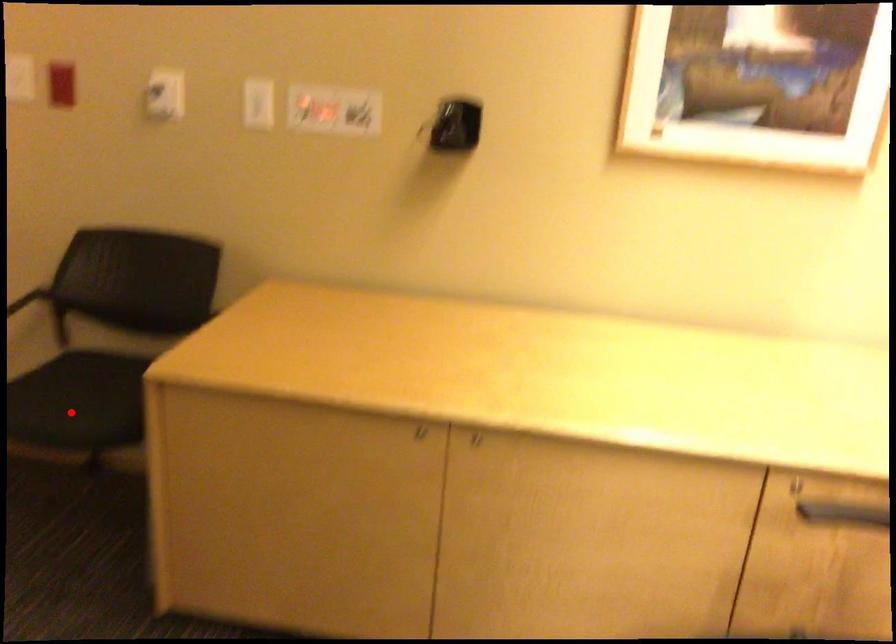
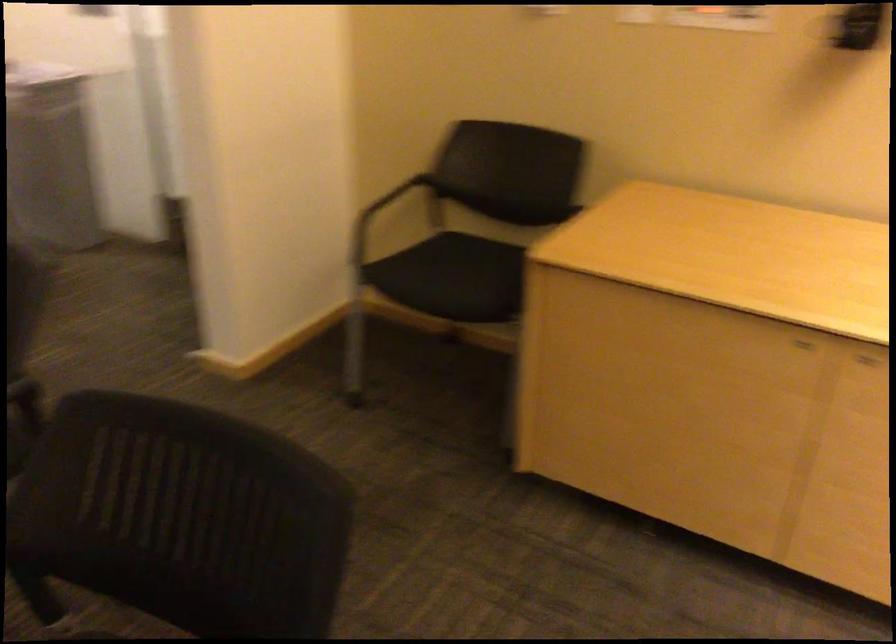
Question: I am providing you with two images of the same scene from different viewpoints. A red point is shown in image1. For the corresponding object point in image2, is it positioned nearer or farther from the camera?

Choices:
 (A) Nearer
 (B) Farther

Answer: (B)